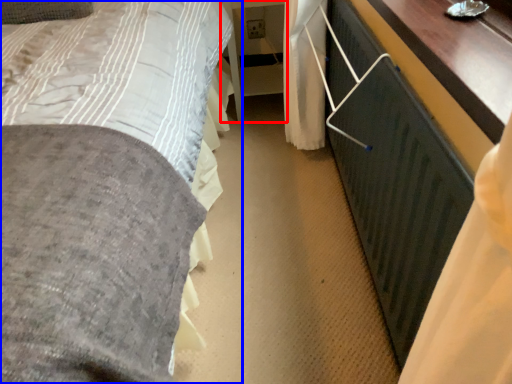
Question: Which object is closer to the camera taking this photo, table (highlighted by a red box) or bed (highlighted by a blue box)?

Choices:
 (A) table
 (B) bed

Answer: (B)